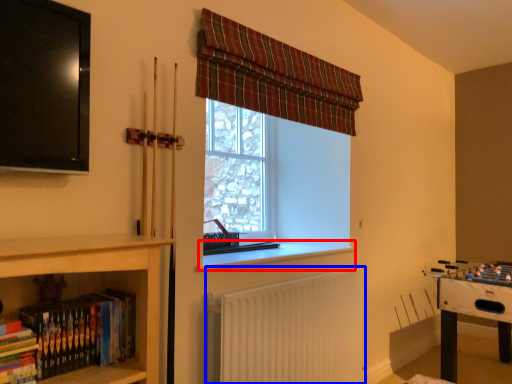
Question: Which object appears farthest to the camera in this image, window sill (highlighted by a red box) or radiator (highlighted by a blue box)?

Choices:
 (A) window sill
 (B) radiator

Answer: (A)